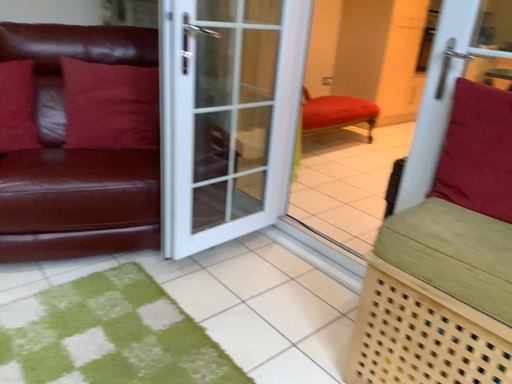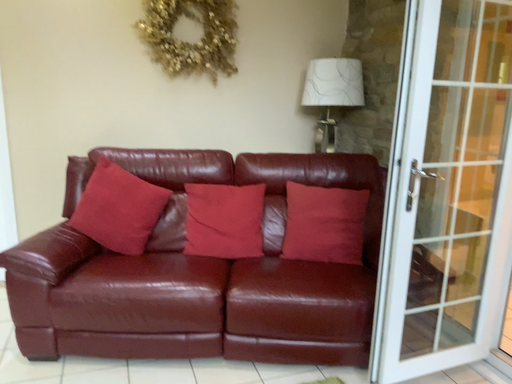
Question: Which way did the camera rotate in the video?

Choices:
 (A) rotated upward
 (B) rotated downward

Answer: (A)